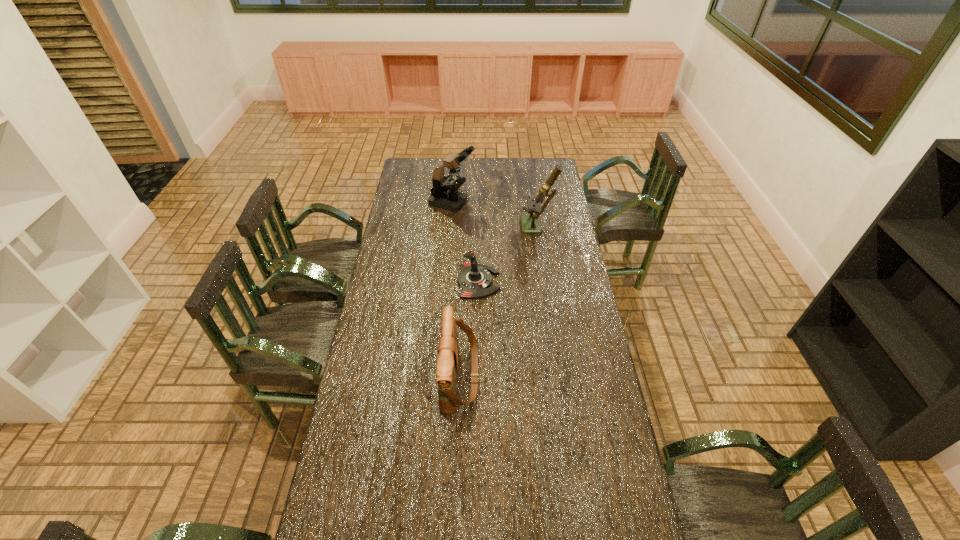
What are the coordinates of `the farthest object` in the screenshot? It's located at (444, 194).

I want to click on the farther microscope, so click(444, 194).

The height and width of the screenshot is (540, 960). Find the location of `the rightmost object`. the rightmost object is located at coordinates (530, 224).

At what (x,y) coordinates should I click in order to perform the action: click on the second farthest object. Please return your answer as a coordinate pair (x, y). This screenshot has height=540, width=960. Looking at the image, I should click on (530, 224).

You are a GUI agent. You are given a task and a screenshot of the screen. Output one action in this format:
    pyautogui.click(x=<x>, y=<y>)
    Task: Click on the nearest object
    
    Given the screenshot: What is the action you would take?
    pyautogui.click(x=447, y=363)

Locate an element on the screen. Image resolution: width=960 pixels, height=540 pixels. shoulder bag is located at coordinates (447, 363).

Image resolution: width=960 pixels, height=540 pixels. What are the coordinates of `the second nearest object` in the screenshot? It's located at (474, 280).

I want to click on the shortest object, so click(474, 280).

Where is `vacant space situated on the front of the farther microscope`? vacant space situated on the front of the farther microscope is located at coordinates (447, 265).

Where is `vacant space located 0.210m at the eyepiece of the nearer microscope`? vacant space located 0.210m at the eyepiece of the nearer microscope is located at coordinates (479, 227).